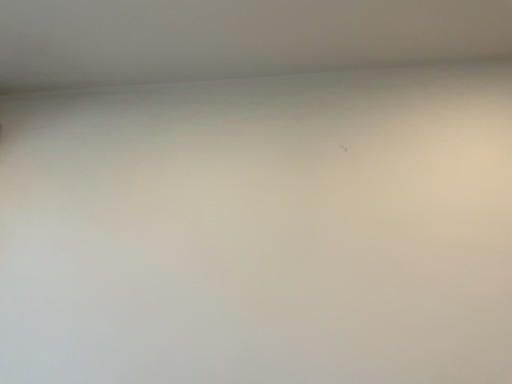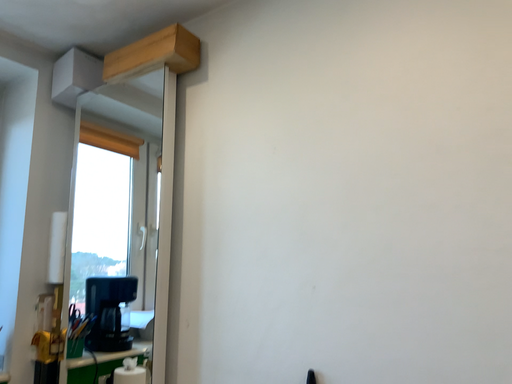
Question: How did the camera likely rotate when shooting the video?

Choices:
 (A) rotated downward
 (B) rotated upward

Answer: (A)